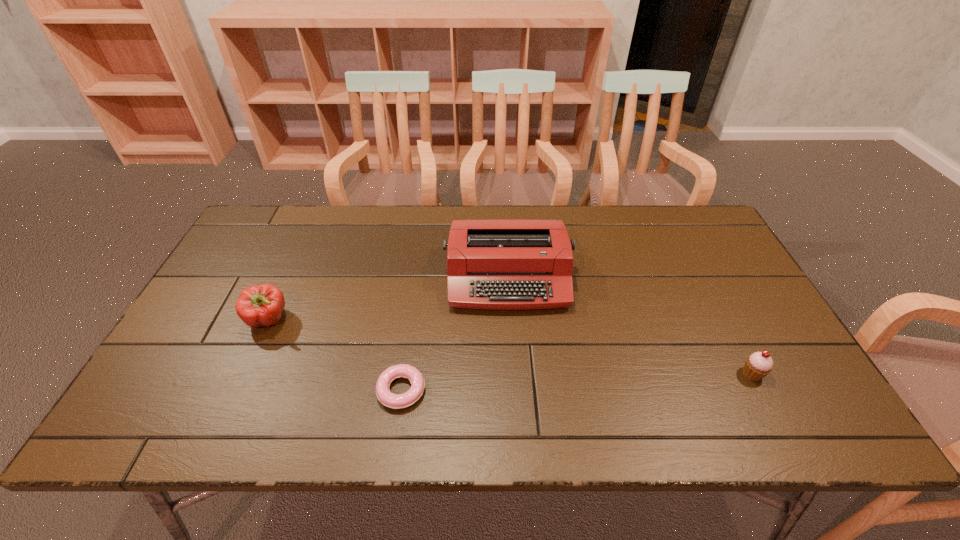
You are a GUI agent. You are given a task and a screenshot of the screen. Output one action in this format:
    pyautogui.click(x=<x>, y=<y>)
    Task: Click on the typewriter
    The image size is (960, 540).
    Given the screenshot: What is the action you would take?
    pyautogui.click(x=491, y=264)

Locate an element on the screen. The image size is (960, 540). the leftmost object is located at coordinates (259, 305).

Locate an element on the screen. Image resolution: width=960 pixels, height=540 pixels. the rightmost object is located at coordinates (758, 365).

This screenshot has height=540, width=960. In order to click on cupcake in this screenshot , I will do `click(758, 365)`.

Where is `doughnut`? The width and height of the screenshot is (960, 540). doughnut is located at coordinates (395, 401).

Find the location of a particular element. the shortest object is located at coordinates (x=395, y=401).

You are a GUI agent. You are given a task and a screenshot of the screen. Output one action in this format:
    pyautogui.click(x=<x>, y=<y>)
    Task: Click on the free region located 0.060m on the typing side of the second object from right to left
    The image size is (960, 540).
    Given the screenshot: What is the action you would take?
    (512, 332)

Locate an element on the screen. This screenshot has height=540, width=960. free location located on the front of the bell pepper is located at coordinates (252, 356).

The width and height of the screenshot is (960, 540). I want to click on vacant space situated on the left of the rightmost object, so click(588, 374).

This screenshot has height=540, width=960. What are the coordinates of `free space located 0.150m on the right of the shortest object` in the screenshot? It's located at (492, 390).